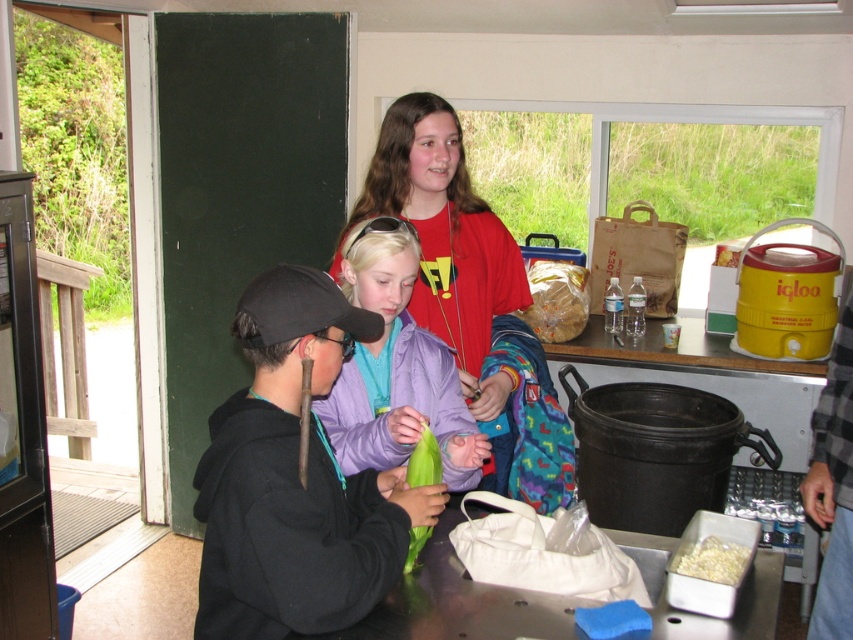
You are standing in the room and want to reach both points. Which point, point (213, 634) or point (352, 454), will you reach first?

Point (213, 634) is closer to the viewer than point 0.711, 0.4114, so you will reach point (213, 634) first.